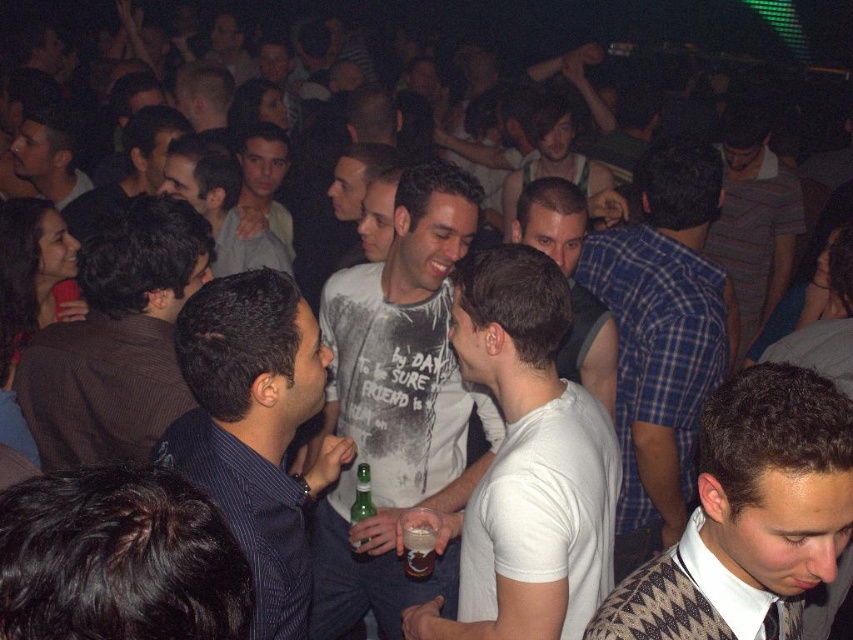
Is brown textured shirt at left behind white t-shirt at center?

No, it is in front of white t-shirt at center.

Is brown textured shirt at left to the right of white t-shirt at center from the viewer's perspective?

Incorrect, brown textured shirt at left is not on the right side of white t-shirt at center.

This screenshot has width=853, height=640. I want to click on brown textured shirt at left, so click(x=117, y=339).

The image size is (853, 640). I want to click on brown textured shirt at left, so tap(117, 339).

How far apart are blue plaid shirt at center and translucent glass beer at center?

The distance of blue plaid shirt at center from translucent glass beer at center is 1.08 meters.

Measure the distance between point (642,269) and camera.

9.79 feet

What do you see at coordinates (662, 337) in the screenshot? The width and height of the screenshot is (853, 640). I see `blue plaid shirt at center` at bounding box center [662, 337].

Locate an element on the screen. The width and height of the screenshot is (853, 640). blue plaid shirt at center is located at coordinates (662, 337).

Which is below, blue plaid shirt at center or dark blue shirt at center?

Positioned lower is blue plaid shirt at center.

Is blue plaid shirt at center thinner than dark blue shirt at center?

Incorrect, blue plaid shirt at center's width is not less than dark blue shirt at center's.

Does point (624, 225) lie behind point (138, 144)?

No, it is not.

Where is `blue plaid shirt at center`? The height and width of the screenshot is (640, 853). blue plaid shirt at center is located at coordinates (662, 337).